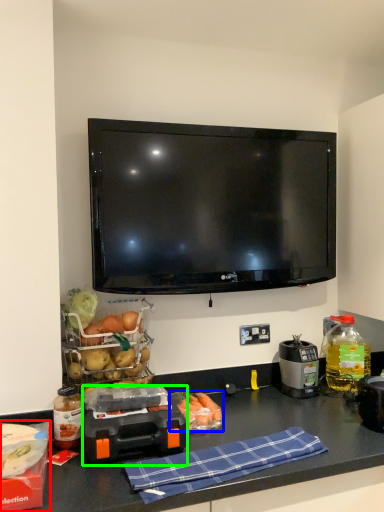
Question: Which is farther away from box (highlighted by a red box)? food (highlighted by a blue box) or appliance (highlighted by a green box)?

Choices:
 (A) food
 (B) appliance

Answer: (A)